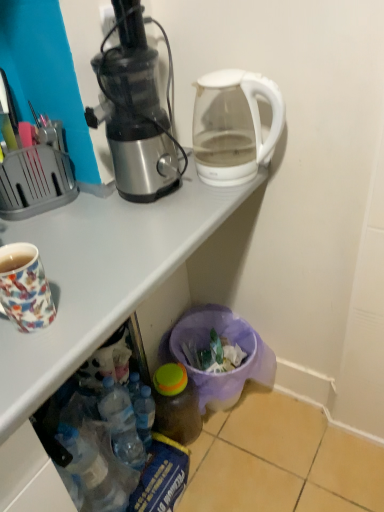
Where is `vacant space in front of multicolored ceramic mug at left`? vacant space in front of multicolored ceramic mug at left is located at coordinates (29, 362).